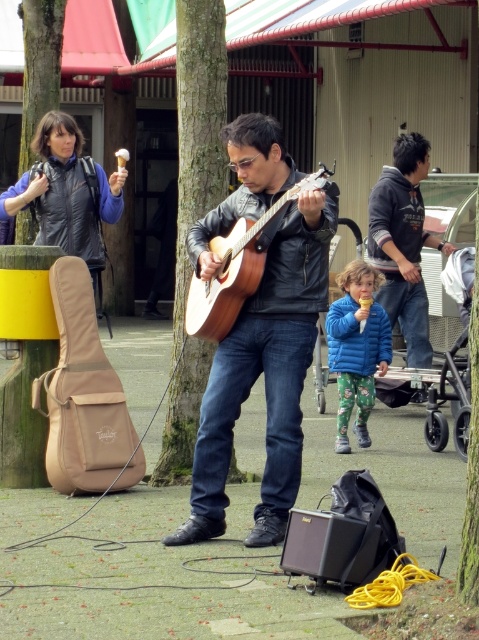
Question: Is blue fleece jacket at center bigger than green rough bark tree at upper left?

Choices:
 (A) yes
 (B) no

Answer: (B)

Question: Is the position of blue fleece jacket at center less distant than that of green rough bark tree at upper left?

Choices:
 (A) yes
 (B) no

Answer: (A)

Question: Which object is closer to the camera taking this photo?

Choices:
 (A) dark gray hoodie at upper right
 (B) blue fleece jacket at center
 (C) matte brown acoustic guitar at center

Answer: (C)

Question: Which point is closer to the camera taking this photo?

Choices:
 (A) (307, 346)
 (B) (49, 61)

Answer: (A)

Question: Is green rough bark tree at center bigger than green rough bark tree at upper left?

Choices:
 (A) yes
 (B) no

Answer: (A)

Question: Which of these objects is positioned closest to the wooden acoustic guitar at center?

Choices:
 (A) dark gray hoodie at upper right
 (B) matte brown acoustic guitar at center
 (C) blue fleece jacket at center
 (D) green rough bark tree at center

Answer: (B)